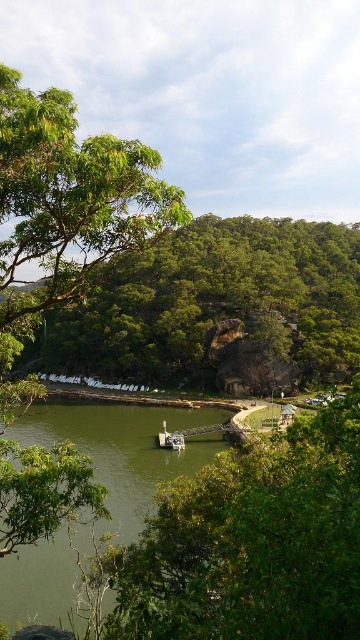
Who is higher up, green leafy tree at upper left or green leafy tree at left?

green leafy tree at upper left is above.

Which of these two, green leafy tree at upper left or green leafy tree at left, stands shorter?

Standing shorter between the two is green leafy tree at left.

Between point (88, 316) and point (12, 324), which one is positioned in front?

Point (12, 324) is more forward.

Where is `green leafy tree at upper left`? The image size is (360, 640). green leafy tree at upper left is located at coordinates (213, 301).

Can you confirm if green leafy tree at lower center is smaller than green leafy tree at left?

Correct, green leafy tree at lower center occupies less space than green leafy tree at left.

Is green leafy tree at lower center taller than green leafy tree at left?

No.

Between point (275, 620) and point (30, 106), which one is positioned in front?

Point (275, 620)

Locate an element on the screen. This screenshot has height=640, width=360. green leafy tree at lower center is located at coordinates pos(253,541).

Between green leafy tree at lower center and green smooth water at center, which one is positioned higher?

green leafy tree at lower center

Between green leafy tree at lower center and green smooth water at center, which one appears on the left side from the viewer's perspective?

green smooth water at center

Is point (325, 506) positioned in front of point (62, 408)?

Yes.

The height and width of the screenshot is (640, 360). Find the location of `green leafy tree at lower center`. green leafy tree at lower center is located at coordinates coord(253,541).